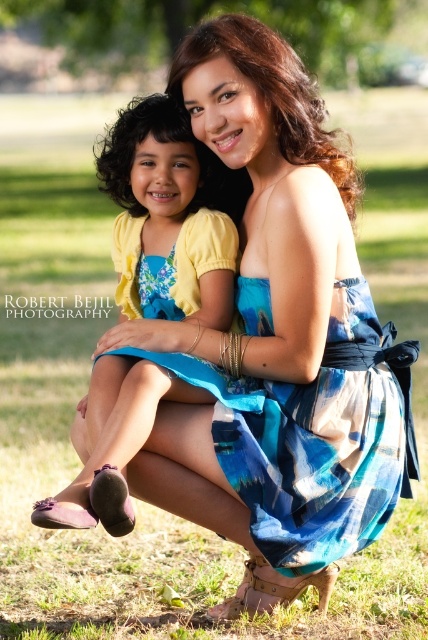
Which of these two, matte yellow dress at center or green leafy tree at upper center, stands shorter?

Standing shorter between the two is matte yellow dress at center.

Does point (124, 518) come in front of point (23, 38)?

Yes, point (124, 518) is closer to viewer.

Describe the element at coordinates (168, 218) in the screenshot. I see `matte yellow dress at center` at that location.

Locate an element on the screen. This screenshot has height=640, width=428. matte yellow dress at center is located at coordinates (168, 218).

Can you confirm if blue plaid dress at center is positioned below green leafy tree at upper center?

Yes.

Is point (333, 365) closer to camera compared to point (297, 4)?

Yes, point (333, 365) is in front of point (297, 4).

In order to click on blue plaid dress at center in this screenshot , I will do `click(323, 442)`.

Who is lower down, blue plaid dress at center or matte yellow dress at center?

Positioned lower is blue plaid dress at center.

Is point (264, 410) positioned after point (131, 220)?

No, it is in front of (131, 220).

Where is `blue plaid dress at center`? blue plaid dress at center is located at coordinates (323, 442).